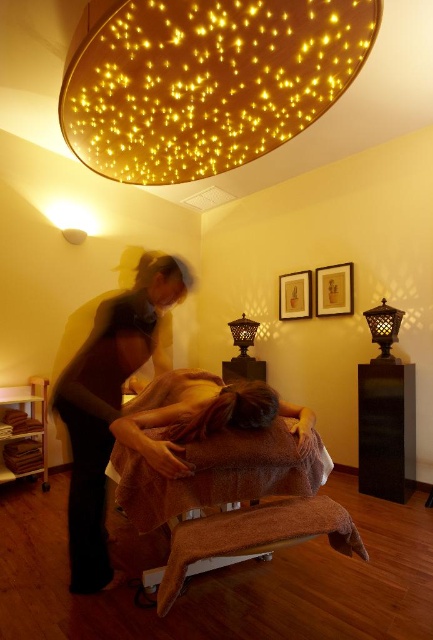
You are a photographer standing at the camera position in the spa room. You want to take a closeup photo of the brown towel at center. The camera has a minimum focusing distance of 1.5 meters. Can you take the photo without moving closer?

The brown towel at center is 1.69 meters away from camera. Since the minimum focusing distance is 1.5 meters, the camera can focus on the brown towel at center as the distance is within range.

Consider the image. You are a client in the spa and want to locate both the illuminated fiber optic ceiling at upper center and the matte black lantern at center. Which of these two objects is bigger in size?

The illuminated fiber optic ceiling at upper center is larger in size compared to the matte black lantern at center.

You are a spa attendant who needs to place a new decorative item on the massage table. The item requires a space that is wider than the matte black lantern at center. Can the brown towel at center provide enough space for this item?

The brown towel at center is wider than the matte black lantern at center, so it can accommodate the decorative item needing more space than the lantern.